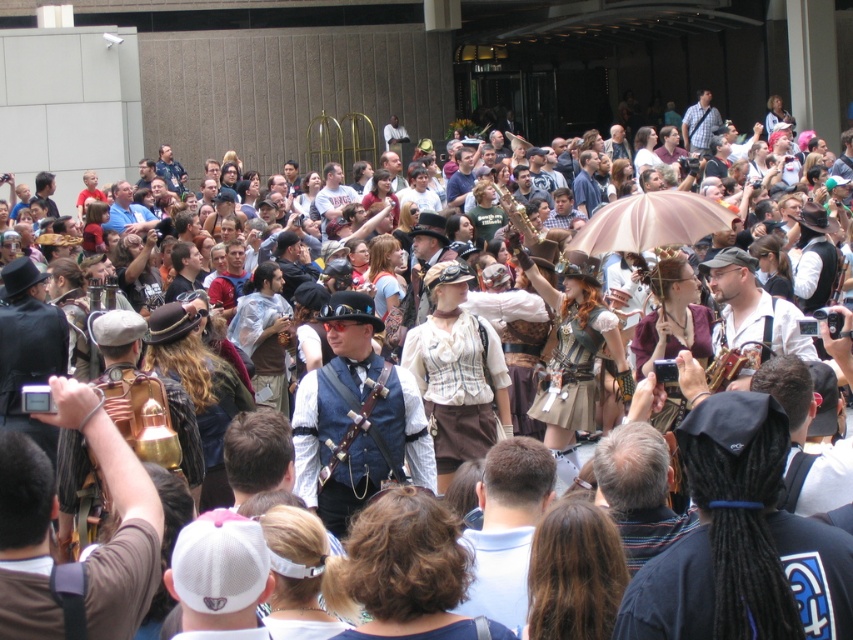
You are a photographer at the event and want to capture a photo of both the black fabric dreadlocks at center and the steampunk attire at center. Which object is positioned closer to the camera?

The black fabric dreadlocks at center is closer to the viewer than the steampunk attire at center, so the black fabric dreadlocks at center would appear closer to the camera.

You are a photographer standing at the event and want to take a closeup photo of the matte blue vest at center. Given that your camera has a maximum zoom range of 25 meters, will you be able to capture the vest clearly without moving closer?

The matte blue vest at center is 30.34 meters away from the viewer. Since the camera can only zoom up to 25 meters, it won not be able to capture the vest clearly without moving closer.